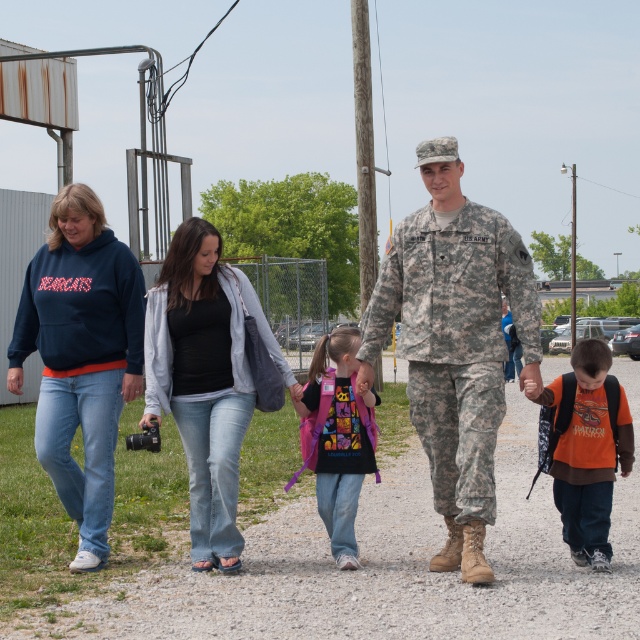
Who is positioned more to the right, denim jeans at center or orange cotton shirt at lower right?

From the viewer's perspective, orange cotton shirt at lower right appears more on the right side.

Locate an element on the screen. This screenshot has width=640, height=640. denim jeans at center is located at coordinates (205, 380).

Does camouflage fabric uniform at center have a larger size compared to camouflage uniform at center?

Yes, camouflage fabric uniform at center is bigger than camouflage uniform at center.

Is point (429, 413) farther from camera compared to point (440, 252)?

Yes, point (429, 413) is behind point (440, 252).

Find the location of a particular element. camouflage fabric uniform at center is located at coordinates (454, 340).

Between matte purple backpack at center and camouflage uniform at center, which one has less height?

camouflage uniform at center is shorter.

Does matte purple backpack at center have a smaller size compared to camouflage uniform at center?

Incorrect, matte purple backpack at center is not smaller in size than camouflage uniform at center.

Is point (308, 410) more distant than point (148, 387)?

Yes, it is behind point (148, 387).

In order to click on matte purple backpack at center in this screenshot , I will do `click(337, 436)`.